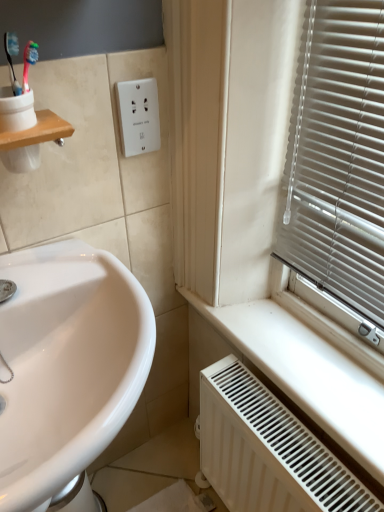
Question: Is white plastic outlet at upper center to the left or to the right of white glossy sink at lower left in the image?

Choices:
 (A) right
 (B) left

Answer: (A)

Question: Based on their sizes in the image, would you say white plastic outlet at upper center is bigger or smaller than white glossy sink at lower left?

Choices:
 (A) small
 (B) big

Answer: (A)

Question: Estimate the real-world distances between objects in this image. Which object is farther from the white glossy sink at lower left?

Choices:
 (A) wooden shelf at upper left
 (B) white plastic outlet at upper center
 (C) white matte radiator at lower right

Answer: (B)

Question: Which is nearer to the white glossy sink at lower left?

Choices:
 (A) wooden shelf at upper left
 (B) white matte radiator at lower right
 (C) white plastic outlet at upper center

Answer: (A)